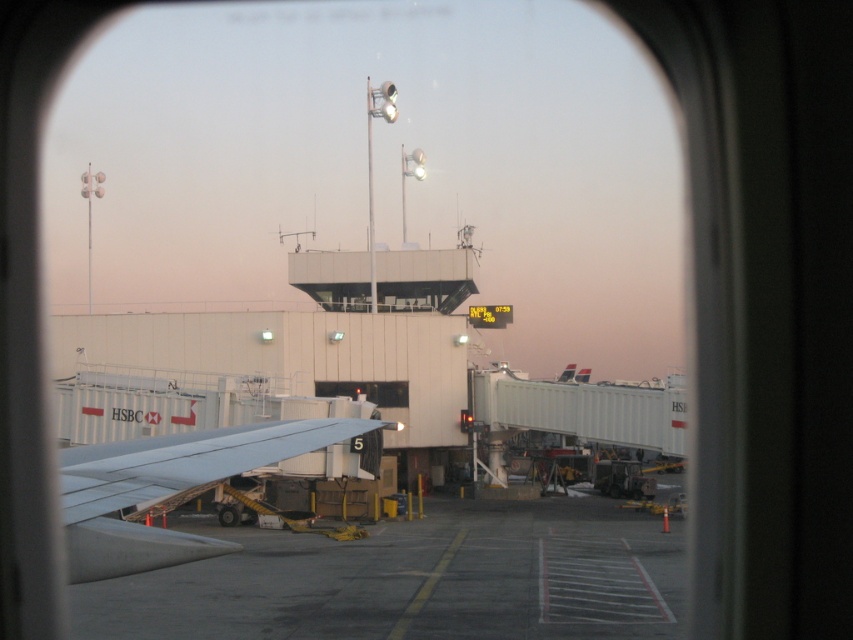
You are a photographer standing inside an aircraft cabin near the window. You want to take a photo of the light gray metallic wing at lower left using a camera that has a minimum focusing distance of 3 meters. Can you take the photo without moving closer to the wing?

The light gray metallic wing at lower left and camera are 4.08 meters apart. Since the minimum focusing distance is 3 meters, the photographer can take the photo without moving closer because the distance is sufficient.

You are a pilot preparing for takeoff and need to check the distance between the gray concrete tarmac at center and the transparent glass window at center from your current position inside the aircraft. Can you confirm if the distance is more than 40 feet?

The gray concrete tarmac at center and transparent glass window at center are 46.64 feet apart, so yes, the distance is more than 40 feet.

From the picture: You are standing inside an aircraft cabin and want to know how far the point at coordinates (589, 600) is from you. Can you determine the distance?

The point at coordinates (589, 600) is 18.87 meters away from you.